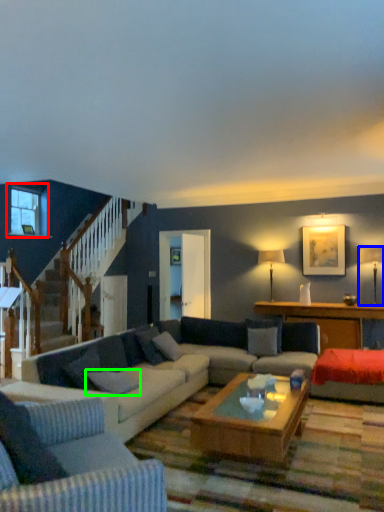
Question: Which is nearer to the window (highlighted by a red box)? lamp (highlighted by a blue box) or pillow (highlighted by a green box).

Choices:
 (A) lamp
 (B) pillow

Answer: (B)